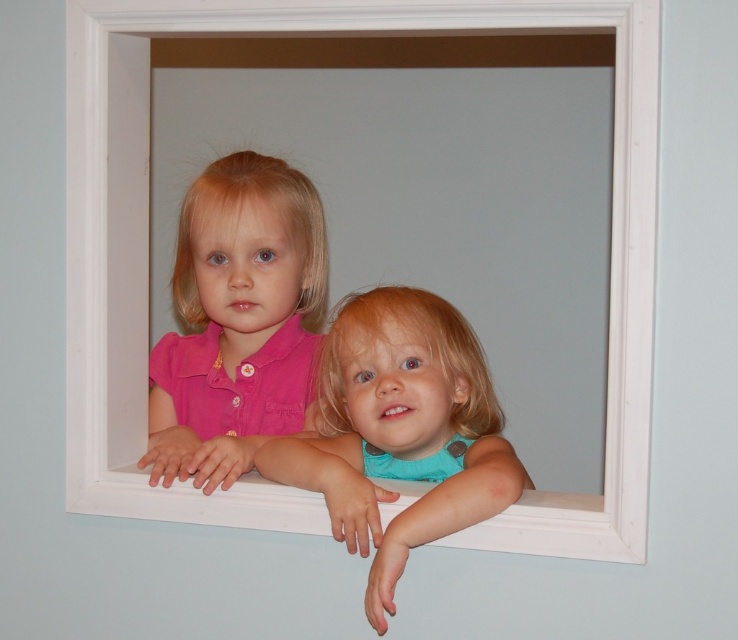
You are a photographer trying to capture the two children in the scene. You want to ensure that the white wooden window frame at center and the turquoise matte shirt at center are both visible in your photo. Based on their positions, which object should you focus on first to frame the shot properly?

The white wooden window frame at center is to the left of the turquoise matte shirt at center, so you should focus on the white wooden window frame at center first to ensure both are in frame.